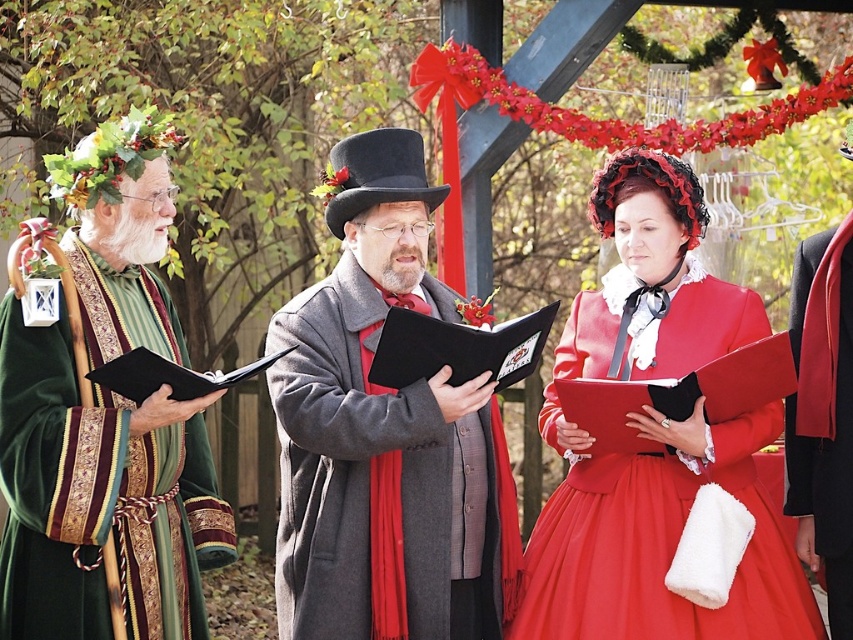
You are a photographer at the event and want to ensure both the velvet gray coat at center and the matte red dress at center are clearly visible in your photo. Given their height difference, which one might you need to adjust your camera angle for to capture both properly?

The velvet gray coat at center is much taller than the matte red dress at center. To capture both properly, you might need to lower your camera angle slightly to ensure the taller velvet gray coat at center doesn not block the view of the shorter matte red dress at center.

You are a photographer trying to capture the central figure holding the black book. There are two points marked in the image. Point A is at coordinates point (498, 506) and Point B is at coordinates point (144, 275). Which point is closer to the central figure?

Point B at coordinates point (144, 275) is closer to the central figure because it is closer to the camera than point A at coordinates point (498, 506), which is further away.